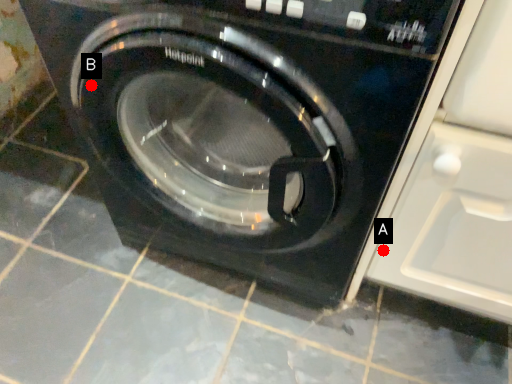
Question: Two points are circled on the image, labeled by A and B beside each circle. Which point is closer to the camera taking this photo?

Choices:
 (A) A is closer
 (B) B is closer

Answer: (B)